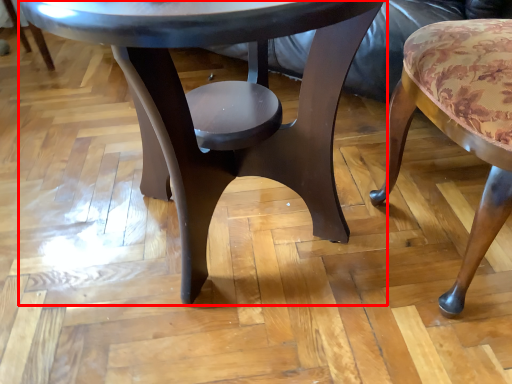
Question: In this image, where is coffee table (annotated by the red box) located relative to chair?

Choices:
 (A) left
 (B) right

Answer: (A)